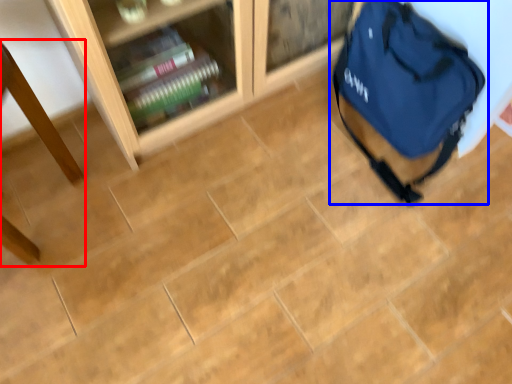
Question: Which object appears farthest to the camera in this image, table (highlighted by a red box) or backpack (highlighted by a blue box)?

Choices:
 (A) table
 (B) backpack

Answer: (B)